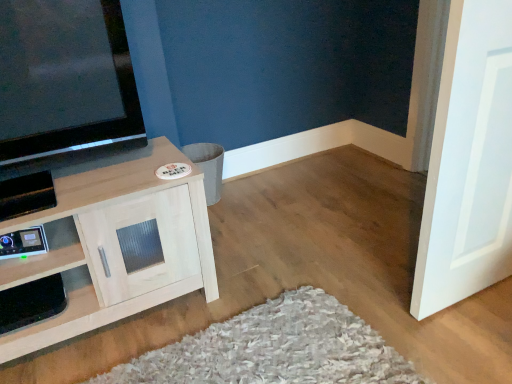
This screenshot has height=384, width=512. I want to click on vacant space situated on the left part of white matte door at right, so click(366, 305).